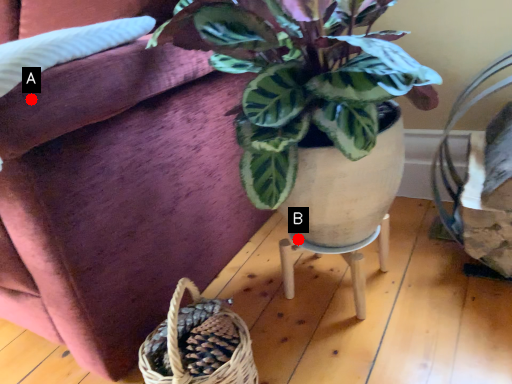
Question: Two points are circled on the image, labeled by A and B beside each circle. Which point is closer to the camera?

Choices:
 (A) A is closer
 (B) B is closer

Answer: (A)